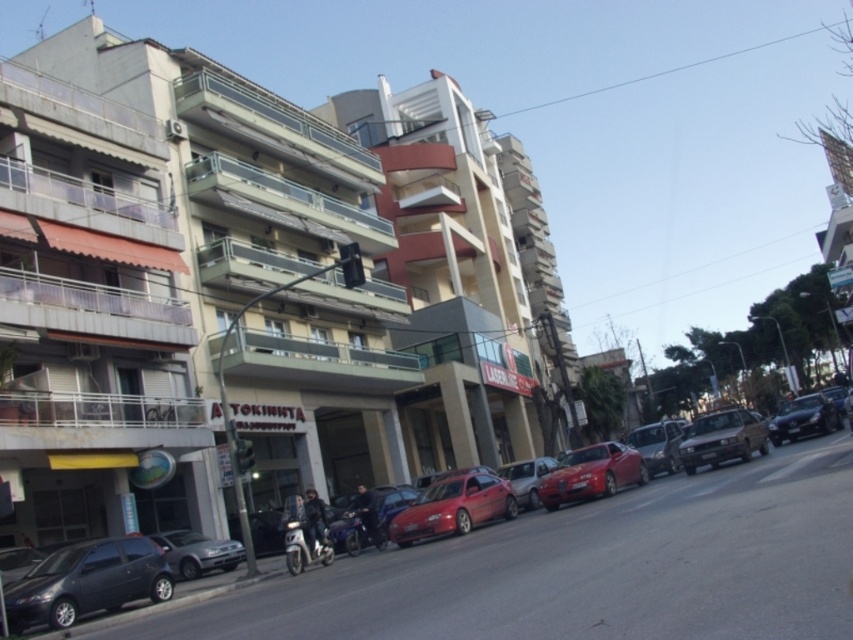
Can you confirm if glossy red car at center is positioned to the right of shiny red car at center?

In fact, glossy red car at center is to the left of shiny red car at center.

Does glossy red car at center come in front of shiny red car at center?

Yes, glossy red car at center is in front of shiny red car at center.

Does point (459, 509) lie behind point (608, 480)?

No.

The width and height of the screenshot is (853, 640). Find the location of `glossy red car at center`. glossy red car at center is located at coordinates (453, 508).

Which is more to the left, shiny red car at center or metallic silver motorcycle at center?

From the viewer's perspective, metallic silver motorcycle at center appears more on the left side.

Measure the distance between shiny red car at center and metallic silver motorcycle at center.

A distance of 5.29 meters exists between shiny red car at center and metallic silver motorcycle at center.

This screenshot has width=853, height=640. I want to click on shiny red car at center, so click(592, 474).

This screenshot has width=853, height=640. Find the location of `shiny red car at center`. shiny red car at center is located at coordinates (592, 474).

How much distance is there between shiny black sedan at right and metallic silver motorcycle at center?

A distance of 52.94 feet exists between shiny black sedan at right and metallic silver motorcycle at center.

Which is in front, point (820, 403) or point (357, 538)?

Positioned in front is point (357, 538).

Find the location of a particular element. The width and height of the screenshot is (853, 640). shiny black sedan at right is located at coordinates (804, 419).